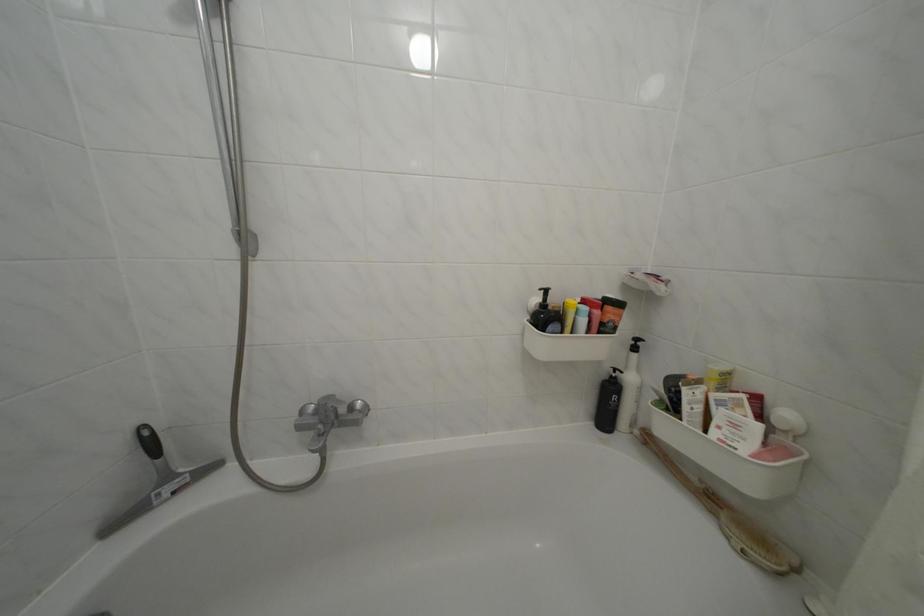
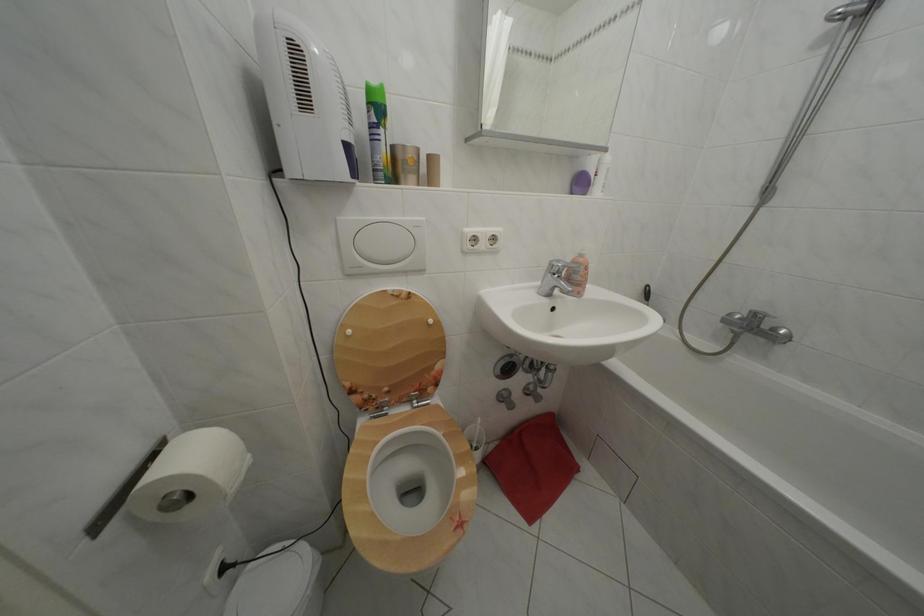
Find the pixel in the second image that matches (359,414) in the first image.

(783, 336)